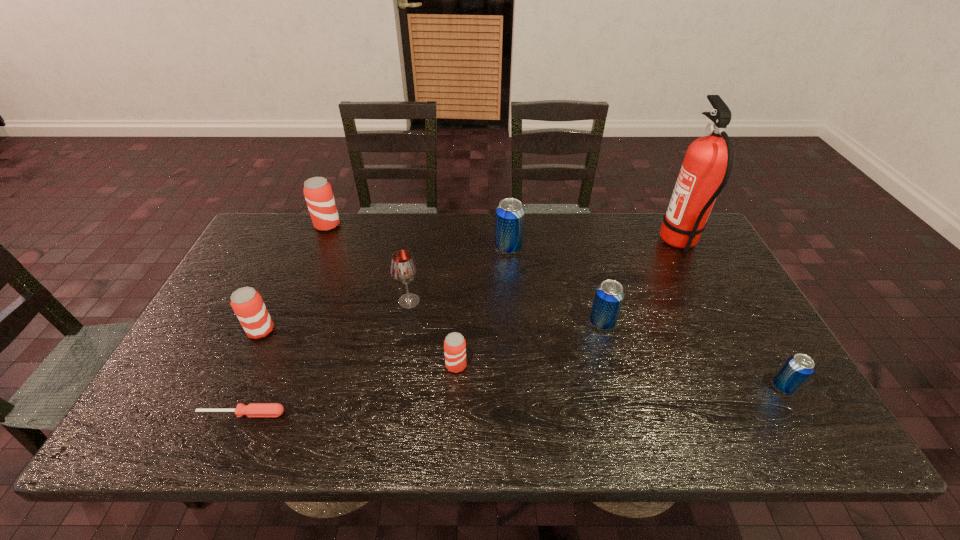
Where is `free space at the far left corner`? The image size is (960, 540). free space at the far left corner is located at coordinates (284, 235).

Image resolution: width=960 pixels, height=540 pixels. I want to click on free space that is in between the red fire extinguisher and the red screwdriver, so click(461, 328).

Where is `vacant area that lies between the nearest object and the third object from right to left`? This screenshot has width=960, height=540. vacant area that lies between the nearest object and the third object from right to left is located at coordinates (421, 368).

The image size is (960, 540). In order to click on free point between the second biggest blue beer can and the fifth farthest beer can in this screenshot , I will do `click(529, 344)`.

At what (x,y) coordinates should I click in order to perform the action: click on empty space between the tallest object and the sixth object from right to left. Please return your answer as a coordinate pair (x, y). Looking at the image, I should click on (544, 272).

I want to click on free space between the red screwdriver and the eighth farthest object, so click(513, 400).

Find the location of a particular element. The height and width of the screenshot is (540, 960). blank region between the rightmost orange beer can and the biggest orange beer can is located at coordinates (392, 295).

Identify the location of vacant space that is in between the fire extinguisher and the biggest blue beer can. (593, 245).

Identify the location of vacant space that's between the leftmost blue beer can and the nearest object. Image resolution: width=960 pixels, height=540 pixels. (375, 330).

The width and height of the screenshot is (960, 540). Identify the location of vacant space that's between the screwdriver and the sixth object from left to right. (375, 330).